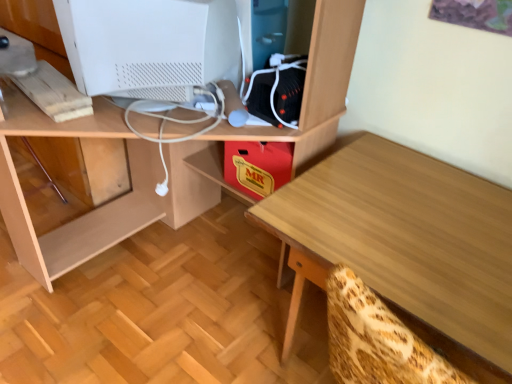
Question: Can you confirm if white matte computer monitor at upper left is wider than wooden desk at center?

Choices:
 (A) no
 (B) yes

Answer: (A)

Question: Is white matte computer monitor at upper left at the left side of wooden desk at center?

Choices:
 (A) yes
 (B) no

Answer: (A)

Question: Does white matte computer monitor at upper left turn towards wooden desk at center?

Choices:
 (A) no
 (B) yes

Answer: (B)

Question: Can you confirm if white matte computer monitor at upper left is shorter than wooden desk at center?

Choices:
 (A) no
 (B) yes

Answer: (B)

Question: Can you confirm if white matte computer monitor at upper left is bigger than wooden desk at center?

Choices:
 (A) yes
 (B) no

Answer: (B)

Question: From the image's perspective, is light wood table at center positioned above or below white matte computer monitor at upper left?

Choices:
 (A) below
 (B) above

Answer: (A)

Question: Is point (333, 193) positioned closer to the camera than point (152, 91)?

Choices:
 (A) closer
 (B) farther

Answer: (A)

Question: Visually, is light wood table at center positioned to the left or to the right of white matte computer monitor at upper left?

Choices:
 (A) left
 (B) right

Answer: (B)

Question: Choose the correct answer: Is light wood table at center inside white matte computer monitor at upper left or outside it?

Choices:
 (A) outside
 (B) inside

Answer: (A)

Question: Choose the correct answer: Is white matte computer monitor at upper left inside light wood table at center or outside it?

Choices:
 (A) inside
 (B) outside

Answer: (B)

Question: Considering their positions, is white matte computer monitor at upper left located in front of or behind light wood table at center?

Choices:
 (A) front
 (B) behind

Answer: (B)

Question: Considering the positions of white matte computer monitor at upper left and light wood table at center in the image, is white matte computer monitor at upper left wider or thinner than light wood table at center?

Choices:
 (A) thin
 (B) wide

Answer: (A)

Question: Is white matte computer monitor at upper left bigger or smaller than light wood table at center?

Choices:
 (A) small
 (B) big

Answer: (A)

Question: Is point (357, 208) closer or farther from the camera than point (83, 117)?

Choices:
 (A) farther
 (B) closer

Answer: (B)

Question: Is light wood table at center in front of or behind wooden desk at center in the image?

Choices:
 (A) behind
 (B) front

Answer: (A)